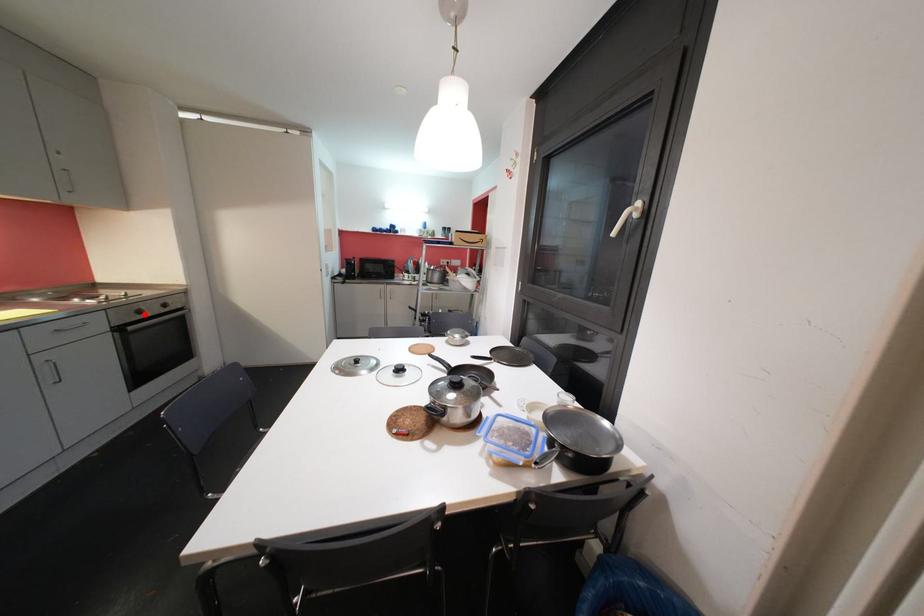
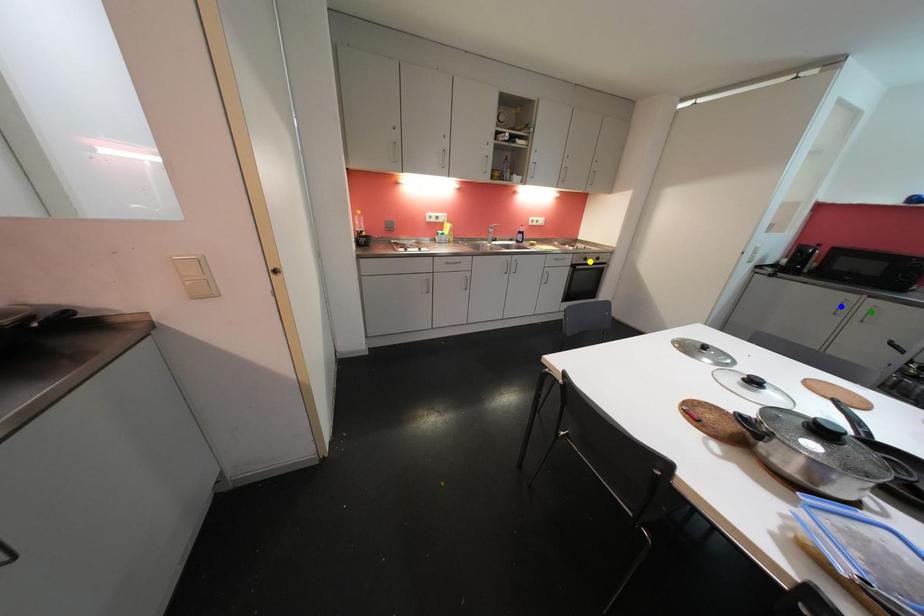
Question: I am providing you with two images of the same scene from different viewpoints. A red point is marked on the first image. You are given multiple points on the second image. Which mark in image 2 goes with the point in image 1?

Choices:
 (A) green point
 (B) yellow point
 (C) blue point

Answer: (B)